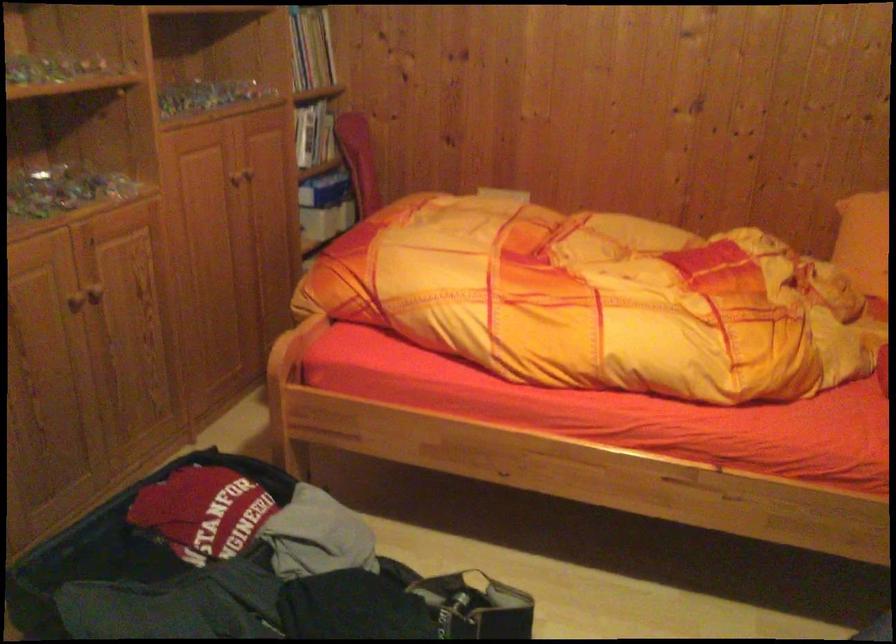
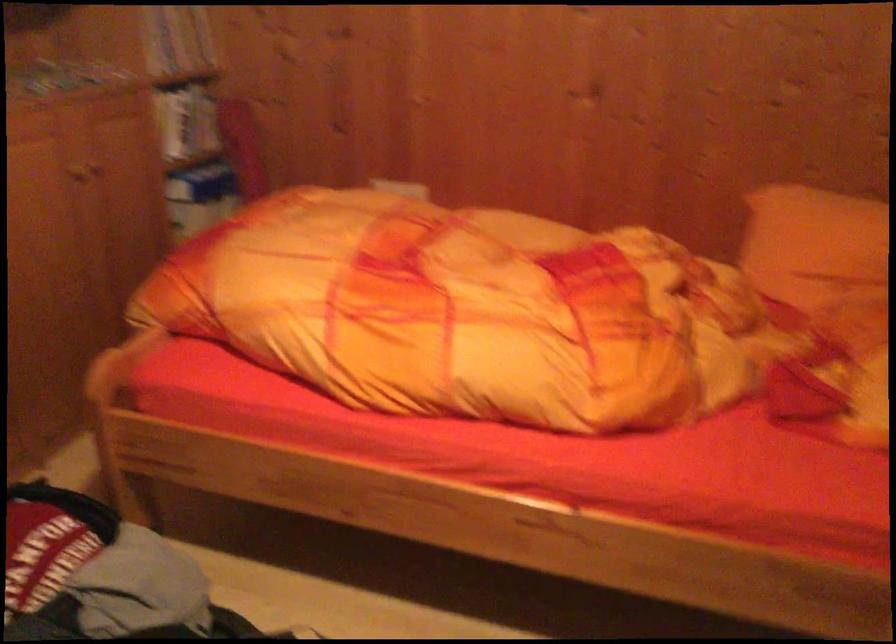
Question: The first image is from the beginning of the video and the second image is from the end. How did the camera likely rotate when shooting the video?

Choices:
 (A) Left
 (B) Right
 (C) Up
 (D) Down

Answer: (D)